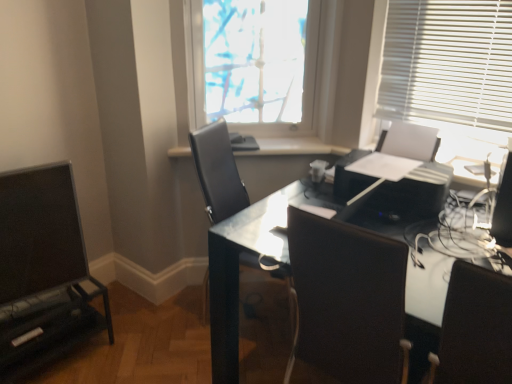
Question: Does white glossy window sill at center have a lesser width compared to translucent fabric at upper center?

Choices:
 (A) yes
 (B) no

Answer: (B)

Question: Does white glossy window sill at center appear on the left side of translucent fabric at upper center?

Choices:
 (A) no
 (B) yes

Answer: (B)

Question: Is the depth of white glossy window sill at center less than that of translucent fabric at upper center?

Choices:
 (A) no
 (B) yes

Answer: (A)

Question: Is white glossy window sill at center in contact with translucent fabric at upper center?

Choices:
 (A) yes
 (B) no

Answer: (B)

Question: Could you tell me if white glossy window sill at center is turned towards translucent fabric at upper center?

Choices:
 (A) yes
 (B) no

Answer: (B)

Question: From a real-world perspective, is white glossy window sill at center positioned under translucent fabric at upper center based on gravity?

Choices:
 (A) yes
 (B) no

Answer: (A)

Question: Can you confirm if matte black monitor at left is wider than black leather chair at center, the second chair in the right-to-left sequence?

Choices:
 (A) yes
 (B) no

Answer: (B)

Question: Does matte black monitor at left lie in front of black leather chair at center, the second chair viewed from the front?

Choices:
 (A) yes
 (B) no

Answer: (A)

Question: Does matte black monitor at left have a lesser width compared to black leather chair at center, positioned as the first chair in back-to-front order?

Choices:
 (A) no
 (B) yes

Answer: (B)

Question: Considering the relative sizes of matte black monitor at left and black leather chair at center, positioned as the first chair in left-to-right order, in the image provided, is matte black monitor at left bigger than black leather chair at center, positioned as the first chair in left-to-right order,?

Choices:
 (A) no
 (B) yes

Answer: (A)

Question: Does matte black monitor at left turn towards black leather chair at center, the second chair in the right-to-left sequence?

Choices:
 (A) no
 (B) yes

Answer: (A)

Question: Considering the relative sizes of matte black monitor at left and black leather chair at center, the second chair viewed from the front, in the image provided, is matte black monitor at left taller than black leather chair at center, the second chair viewed from the front,?

Choices:
 (A) yes
 (B) no

Answer: (B)

Question: From a real-world perspective, is translucent fabric at upper center located beneath glossy black desk at center?

Choices:
 (A) no
 (B) yes

Answer: (A)